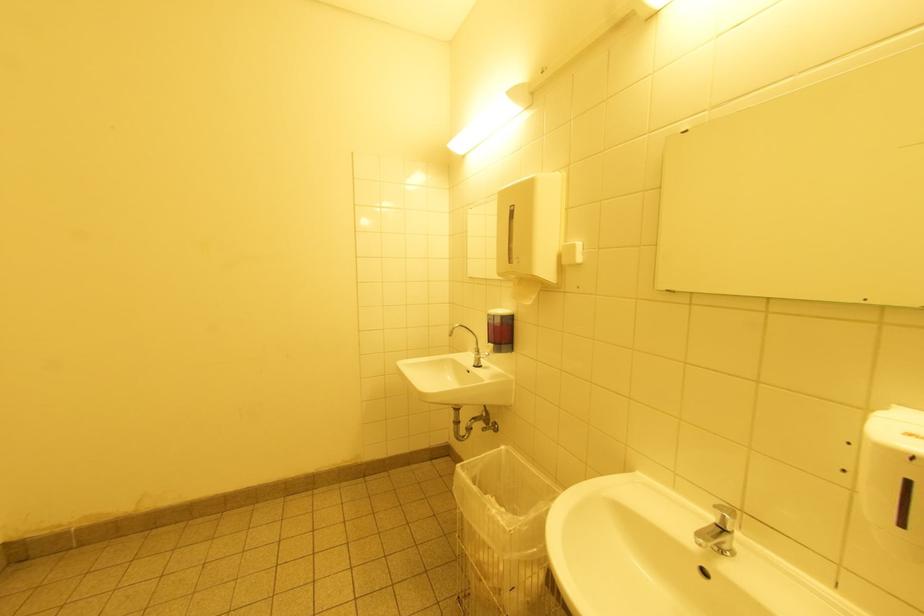
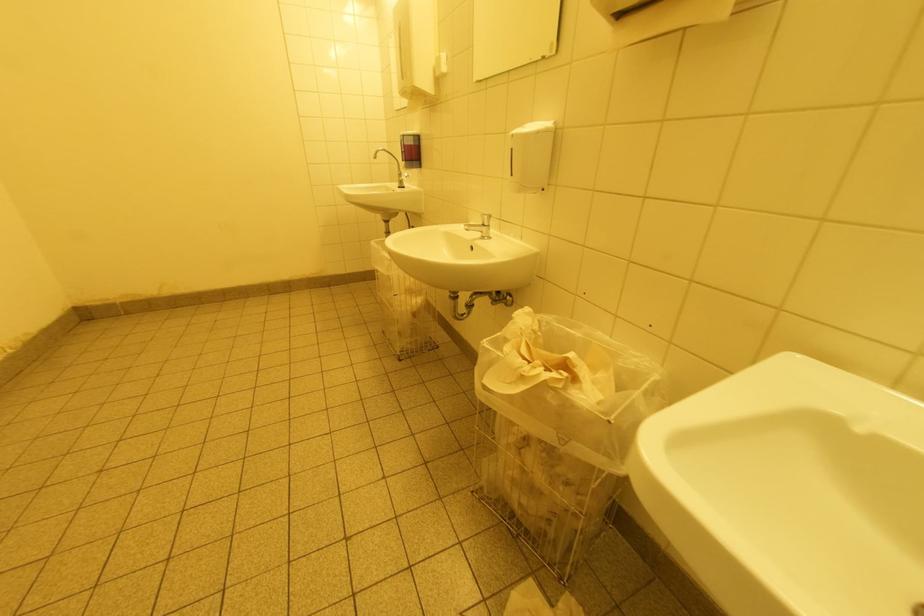
Question: How did the camera likely rotate?

Choices:
 (A) Left
 (B) Right
 (C) Up
 (D) Down

Answer: (D)